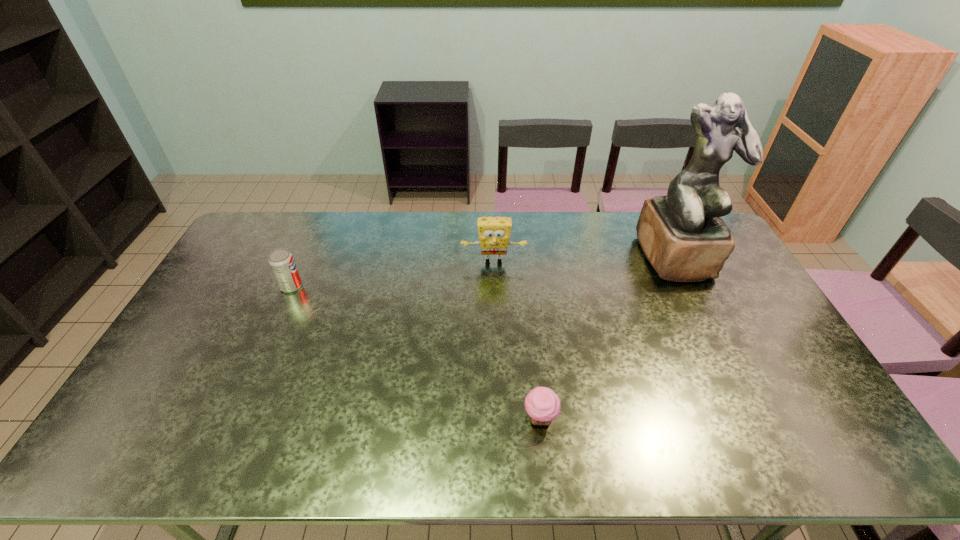
Where is `sculpture`? sculpture is located at coordinates (x=682, y=234).

Where is `the tallest object`? the tallest object is located at coordinates (682, 234).

This screenshot has width=960, height=540. Identify the location of the second tallest object. (494, 232).

In order to click on the leftmost object in this screenshot , I will do `click(281, 261)`.

This screenshot has width=960, height=540. What are the coordinates of `soda` in the screenshot? It's located at (281, 261).

In order to click on cupcake in this screenshot , I will do `click(542, 404)`.

Image resolution: width=960 pixels, height=540 pixels. I want to click on the shortest object, so click(x=542, y=404).

What are the coordinates of `free spot located in a relaxed pose on the tallest object` in the screenshot? It's located at (743, 388).

Identify the location of vacant space located on the face of the third shortest object. The width and height of the screenshot is (960, 540). (494, 301).

What are the coordinates of `vacant region located on the back of the second shortest object` in the screenshot? It's located at (314, 235).